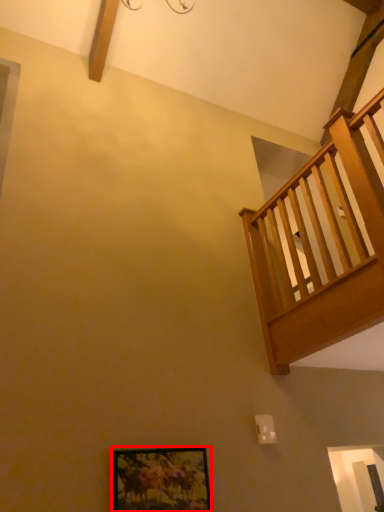
Question: From the image, what is the correct spatial relationship of picture frame (annotated by the red box) in relation to balcony?

Choices:
 (A) right
 (B) left

Answer: (B)